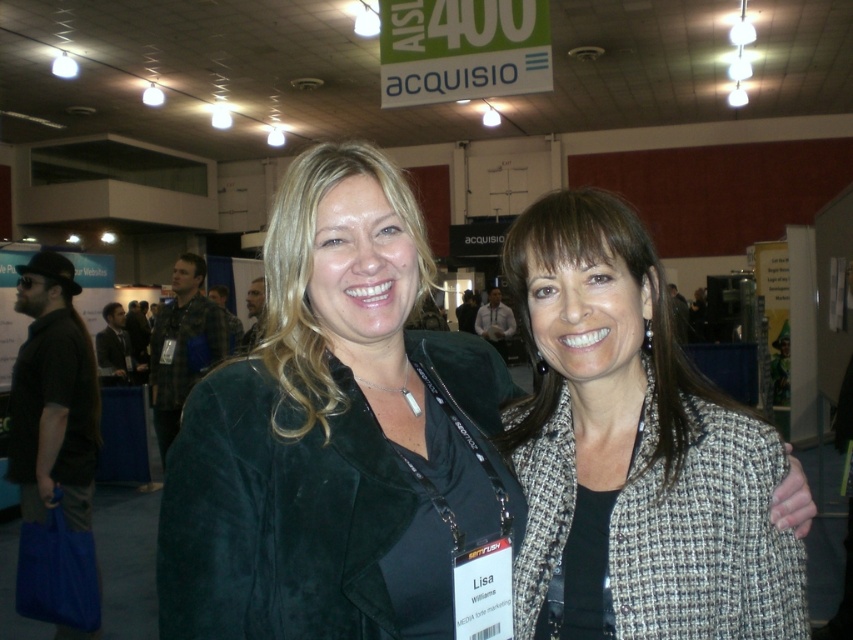
Question: Does velvet black jacket at center come in front of gray tweed blazer at center?

Choices:
 (A) no
 (B) yes

Answer: (B)

Question: Is velvet black jacket at center smaller than gray tweed blazer at center?

Choices:
 (A) no
 (B) yes

Answer: (A)

Question: Which point is farther to the camera?

Choices:
 (A) (666, 468)
 (B) (523, 520)

Answer: (B)

Question: Does velvet black jacket at center have a smaller size compared to gray tweed blazer at center?

Choices:
 (A) no
 (B) yes

Answer: (A)